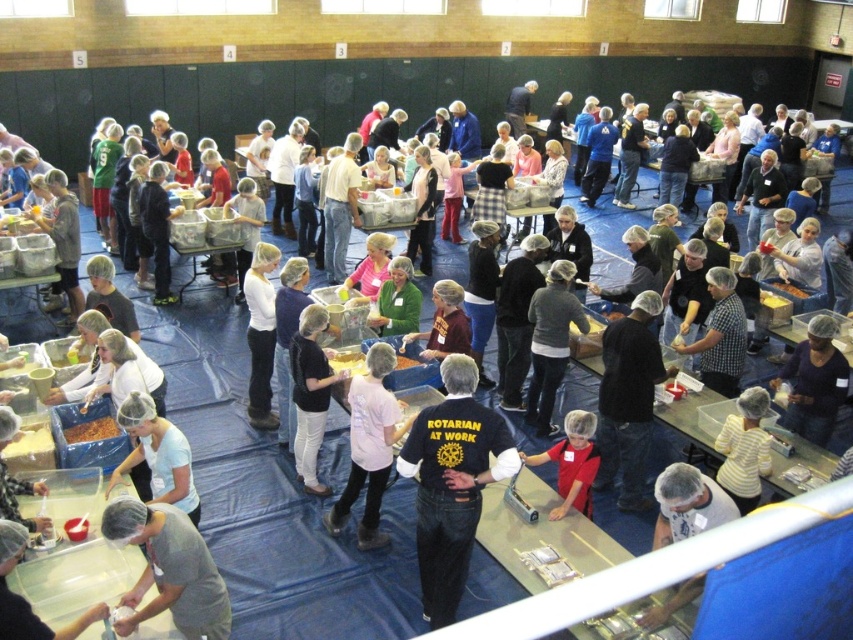
Question: Estimate the real-world distances between objects in this image. Which object is closer to the white matte shirt at center?

Choices:
 (A) gray fabric shirt at lower left
 (B) light blue fabric at lower left

Answer: (B)

Question: Can you confirm if light blue fabric at lower left is thinner than black fabric shirt at center?

Choices:
 (A) yes
 (B) no

Answer: (B)

Question: Does light blue fabric at lower left lie in front of red shirt at center?

Choices:
 (A) no
 (B) yes

Answer: (B)

Question: Among these objects, which one is nearest to the camera?

Choices:
 (A) light blue fabric at lower left
 (B) pink fabric shirt at center

Answer: (A)

Question: Considering the real-world distances, which object is farthest from the white matte shirt at center?

Choices:
 (A) black fabric shirt at center
 (B) light blue fabric at lower left
 (C) black cotton shirt at center
 (D) red shirt at center

Answer: (D)

Question: Does light blue fabric at lower left have a smaller size compared to yellow striped sweater at lower right?

Choices:
 (A) no
 (B) yes

Answer: (A)